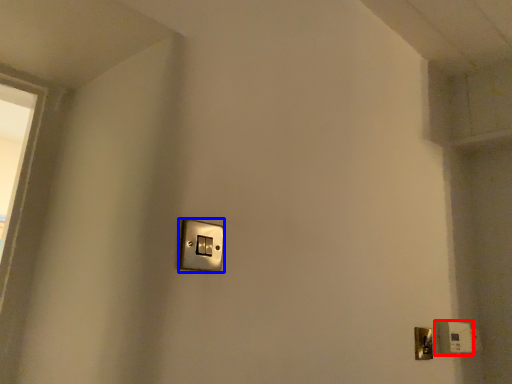
Question: Which of the following is the closest to the observer, light switch (highlighted by a red box) or light switch (highlighted by a blue box)?

Choices:
 (A) light switch
 (B) light switch

Answer: (B)